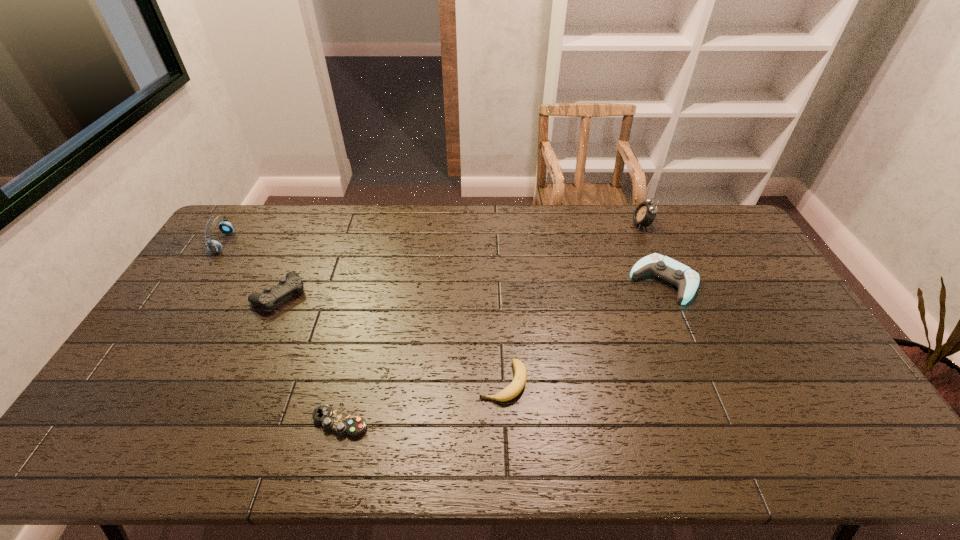
You are a GUI agent. You are given a task and a screenshot of the screen. Output one action in this format:
    pyautogui.click(x=<x>, y=<y>)
    Task: Click on the free spot between the fourth object from left to right and the leftmost control
    
    Given the screenshot: What is the action you would take?
    pyautogui.click(x=392, y=338)

Locate an element on the screen. The height and width of the screenshot is (540, 960). free space between the nearest control and the rightmost control is located at coordinates (502, 352).

Where is `vacant space in between the alarm clock and the headset`? vacant space in between the alarm clock and the headset is located at coordinates (433, 234).

You are a GUI agent. You are given a task and a screenshot of the screen. Output one action in this format:
    pyautogui.click(x=<x>, y=<y>)
    Task: Click on the free space between the fifth object from right to left and the rightmost control
    This screenshot has height=540, width=960.
    Given the screenshot: What is the action you would take?
    pyautogui.click(x=471, y=288)

You are a GUI agent. You are given a task and a screenshot of the screen. Output one action in this format:
    pyautogui.click(x=<x>, y=<y>)
    Task: Click on the empty space between the leftmost control and the alarm clock
    This screenshot has height=540, width=960.
    Given the screenshot: What is the action you would take?
    [461, 260]

At what (x,y) coordinates should I click in order to perform the action: click on unoccupied area between the alarm clock and the shortest control. Please return your answer as a coordinate pair (x, y). Image resolution: width=960 pixels, height=540 pixels. Looking at the image, I should click on (x=491, y=323).

Locate an element on the screen. The width and height of the screenshot is (960, 540). the fifth closest object relative to the shortest object is located at coordinates click(x=645, y=213).

Select which object is the closest to the third object from right to left. Please provide its 2D coordinates. Your answer should be formatted as a tuple, i.e. [(x, y)], where the tuple contains the x and y coordinates of a point satisfying the conditions above.

[(330, 419)]

Where is `control object that ranks as the second closest to the rightmost control`? control object that ranks as the second closest to the rightmost control is located at coordinates (292, 283).

Select which control is the closest to the third object from right to left. Please provide its 2D coordinates. Your answer should be formatted as a tuple, i.e. [(x, y)], where the tuple contains the x and y coordinates of a point satisfying the conditions above.

[(330, 419)]